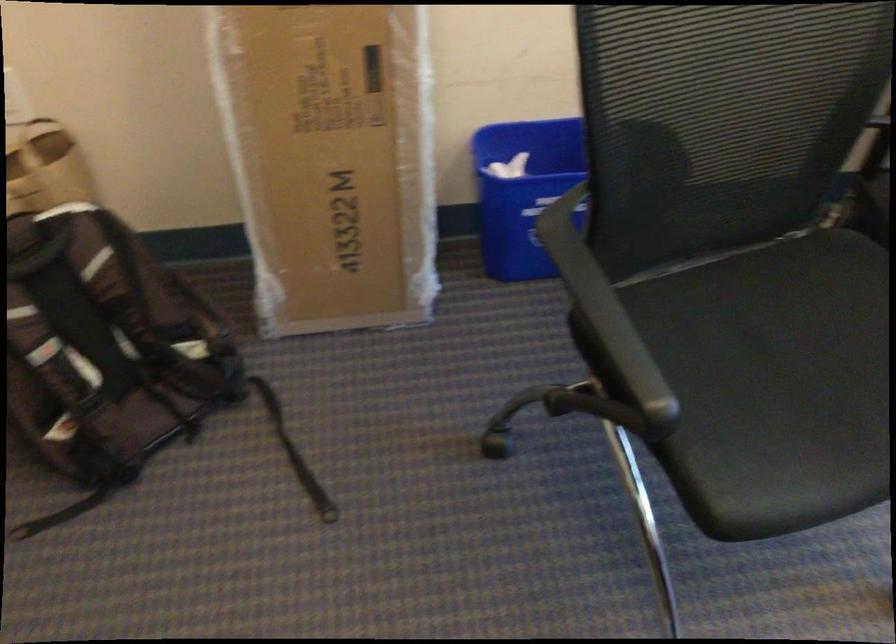
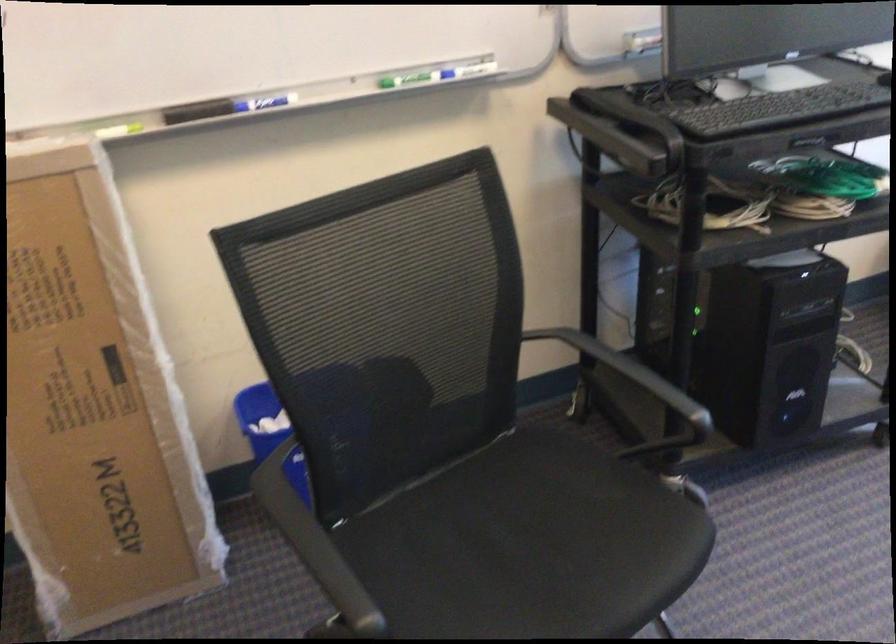
The point at (609, 310) is marked in the first image. Where is the corresponding point in the second image?

(314, 545)